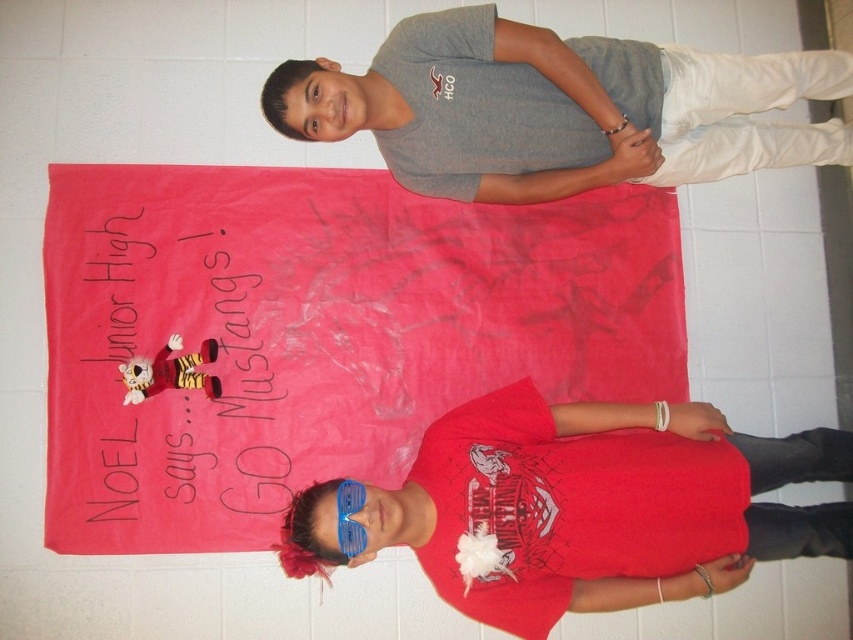
Question: Can you confirm if gray cotton t-shirt at upper center is thinner than handwritten paper at center?

Choices:
 (A) no
 (B) yes

Answer: (A)

Question: Which object is the closest to the shiny blue sunglasses at center?

Choices:
 (A) handwritten paper at center
 (B) gray cotton t-shirt at upper center

Answer: (A)

Question: Which point is farther to the camera?

Choices:
 (A) tap(317, 556)
 (B) tap(114, 234)
 (C) tap(755, 141)

Answer: (C)

Question: Is gray cotton t-shirt at upper center to the right of blue plastic goggles at center from the viewer's perspective?

Choices:
 (A) no
 (B) yes

Answer: (B)

Question: Which point is closer to the camera?

Choices:
 (A) (549, 138)
 (B) (244, 422)

Answer: (A)

Question: Does handwritten paper at center appear on the left side of blue plastic goggles at center?

Choices:
 (A) no
 (B) yes

Answer: (B)